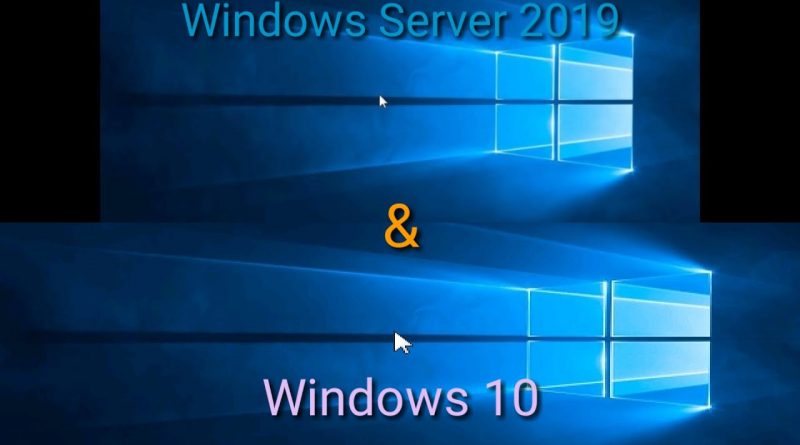
You are a GUI agent. You are given a task and a screenshot of the screen. Output one action in this format:
    pyautogui.click(x=<x>, y=<y>)
    Task: Click on the illuminated corners
    This screenshot has width=800, height=445.
    Given the screenshot: What is the action you would take?
    pyautogui.click(x=709, y=274), pyautogui.click(x=706, y=406), pyautogui.click(x=526, y=291), pyautogui.click(x=526, y=386), pyautogui.click(x=630, y=36), pyautogui.click(x=494, y=52), pyautogui.click(x=493, y=149), pyautogui.click(x=626, y=169)